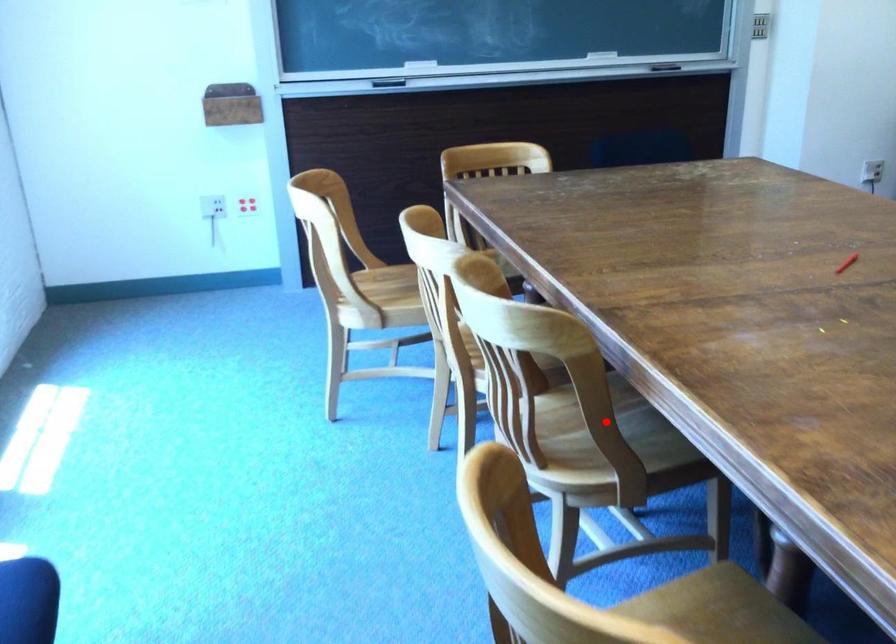
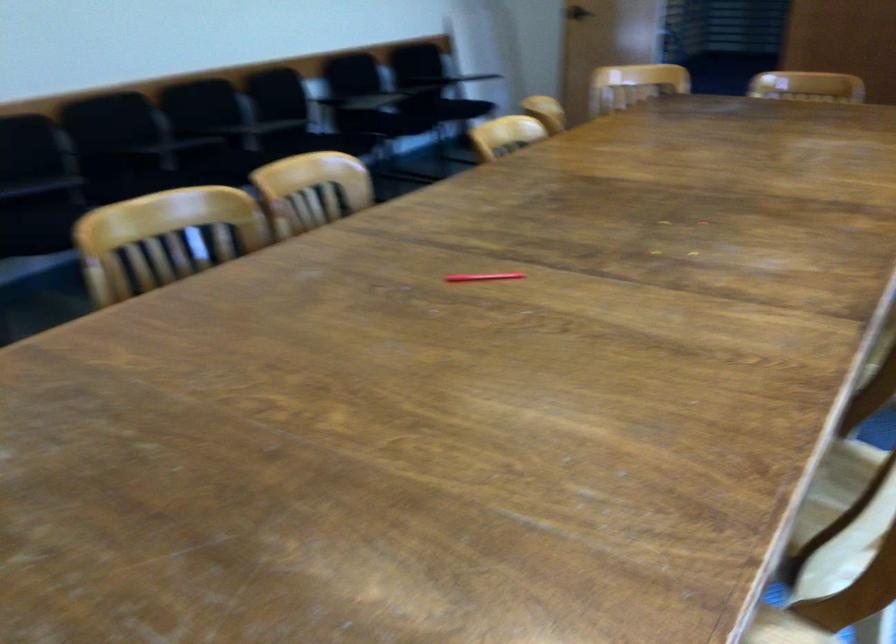
Question: I am providing you with two images of the same scene from different viewpoints. A red point is marked on the first image. Can you still see the location of the red point in image 2?

Choices:
 (A) Yes
 (B) No

Answer: (B)